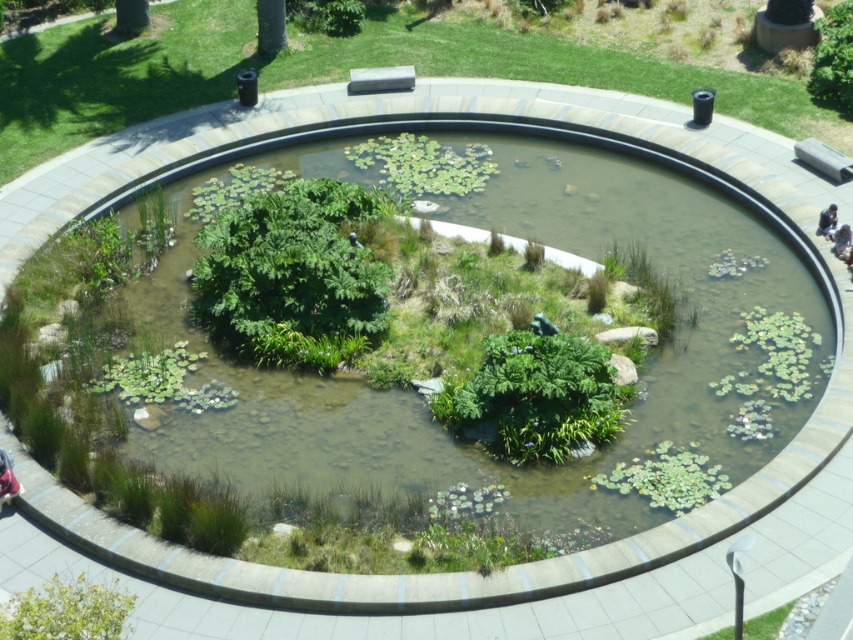
You are standing at the edge of the pond and want to take a photo of the green leafy tree at upper left. If your camera has a maximum zoom range of 20 meters, will you be able to capture the tree clearly without moving closer?

The green leafy tree at upper left is 23.55 meters away from the viewer. Since the camera can only zoom up to 20 meters, you won not be able to capture the tree clearly without moving closer.

You are a visitor in the park and want to take a photo of the green leafy tree at upper center and the dark blue fabric at upper right. Which object is closer to you so that it appears larger in the photo?

The green leafy tree at upper center is closer to you than the dark blue fabric at upper right, so it will appear larger in the photo.